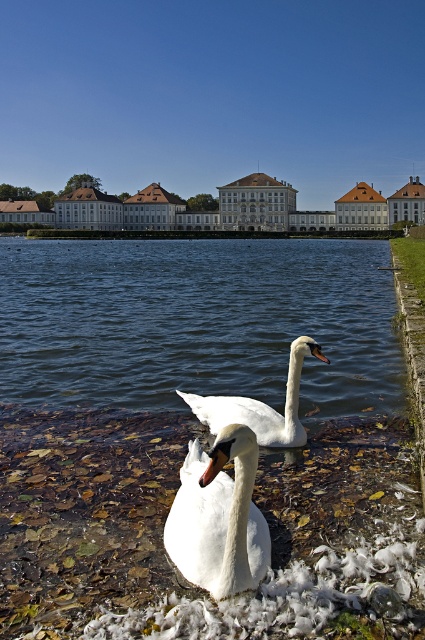
You are a photographer trying to capture both the white matte swan at lower center and the white feathered swan at center in a single frame. Given their sizes, which swan will appear larger in your photo?

The white feathered swan at center will appear larger in the photo because it is bigger in size compared to the white matte swan at lower center.